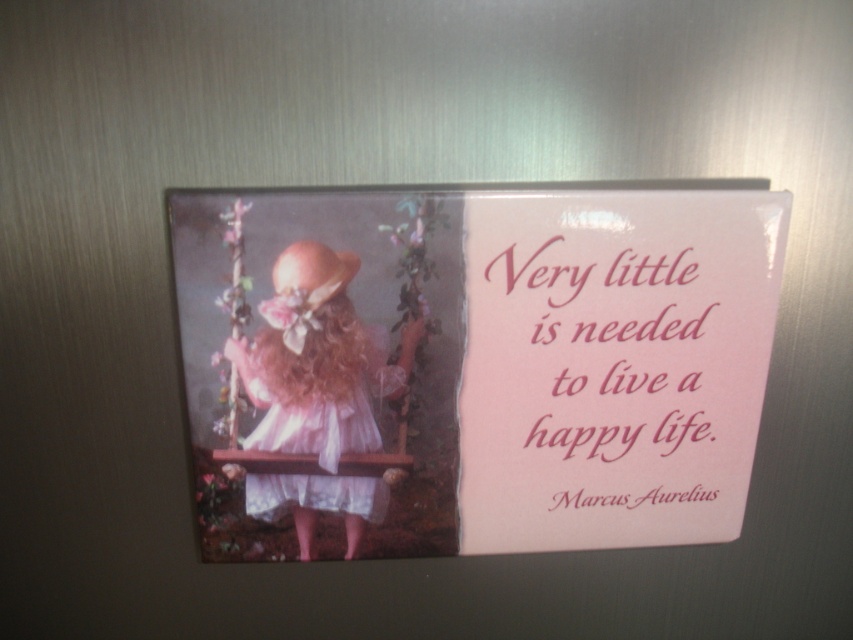
You are organizing a display on a refrigerator and need to ensure that the pink paper plaque at center and the pink paper quote at upper right are visible. Based on their positions, which object is closer to the viewer?

The pink paper plaque at center is closer to the viewer because it is in front of the pink paper quote at upper right.

You are organizing a child birthday party and want to hang the pink paper plaque at center and the pink satin dress at center on a wall. Which object should you hang higher so that the bottom edges align when viewed from the ground?

The pink paper plaque at center is much taller than the pink satin dress at center, so you should hang the pink paper plaque at center higher to ensure their bottom edges align.

Consider the image. You have a frame that can only hold items smaller than the pink paper quote at upper right. Can you fit the pink paper plaque at center into the frame?

The pink paper plaque at center is bigger than the pink paper quote at upper right, so it cannot fit into the frame designed for items smaller than the pink paper quote at upper right.